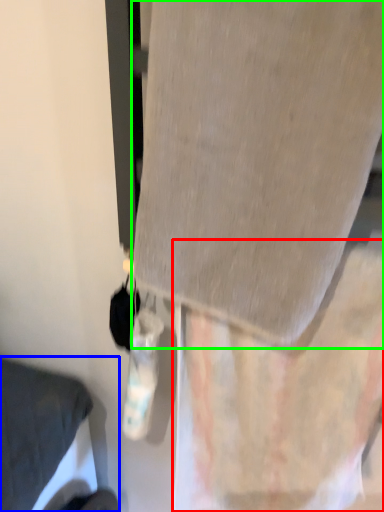
Question: Which object is positioned closest to curtain (highlighted by a red box)? Select from furniture (highlighted by a blue box) and fabric (highlighted by a green box).

Choices:
 (A) furniture
 (B) fabric

Answer: (B)